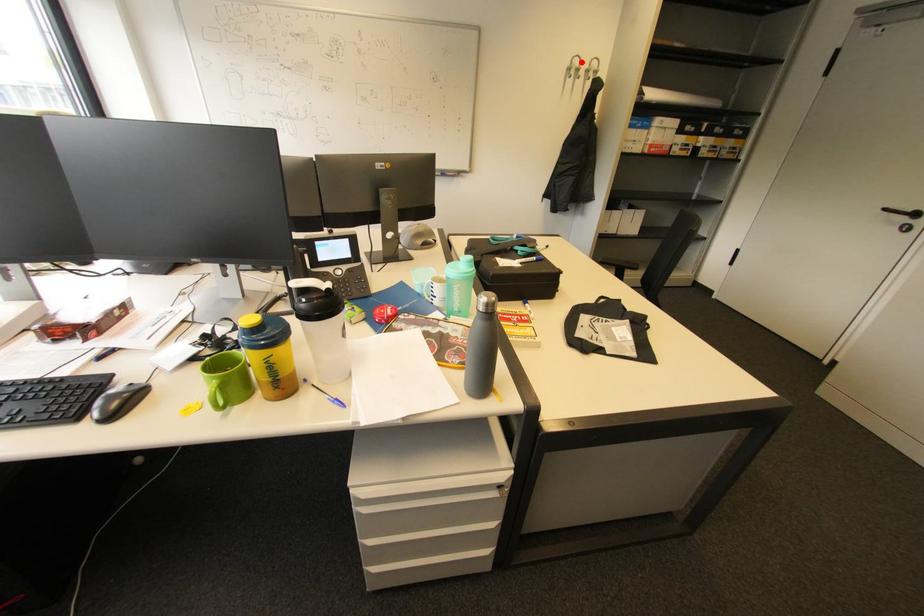
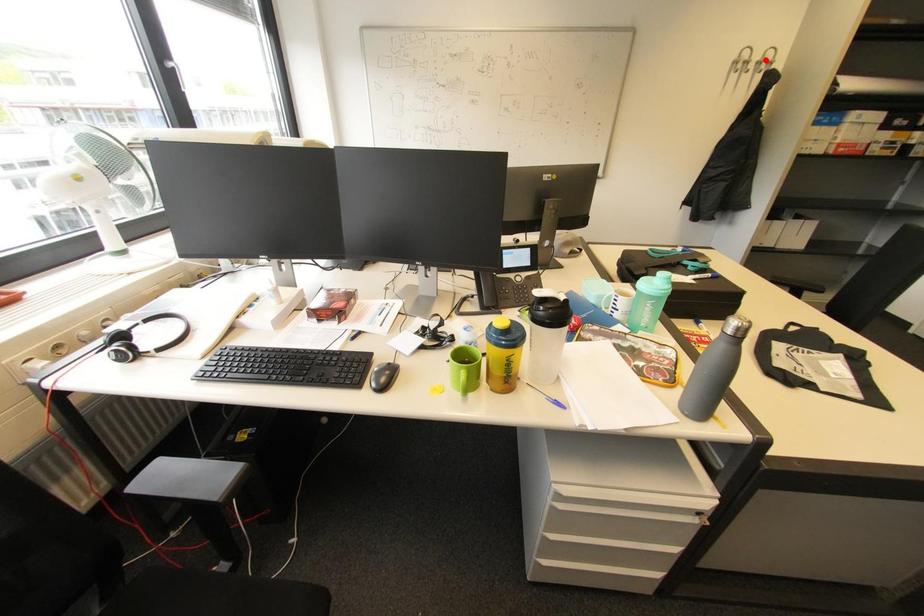
I am providing you with two images of the same scene from different viewpoints. A red point is marked on the first image and another point is marked on the second image. Is the red point in image1 aligned with the point shown in image2?

No